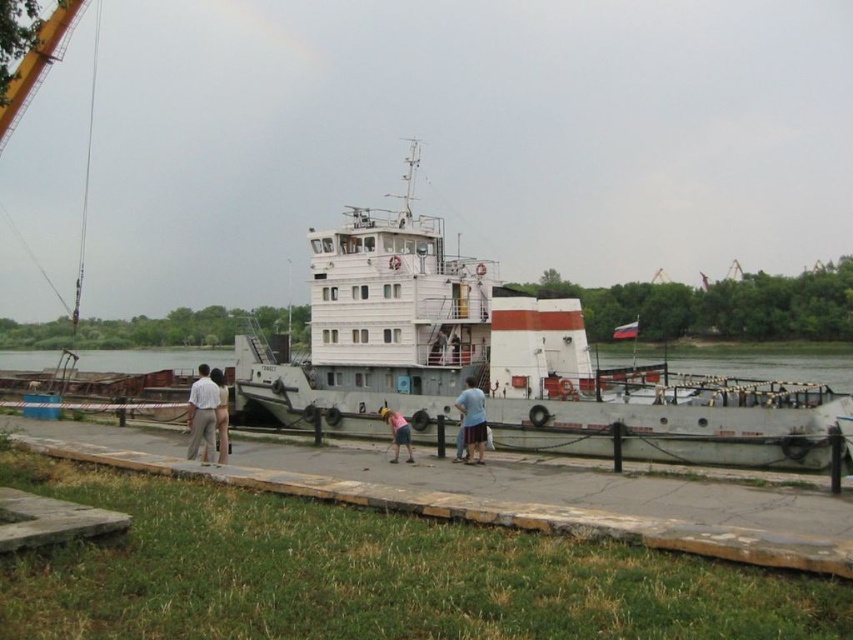
You are standing on the barge and want to take a photo of both the point at coordinates point (192, 442) and point (474, 410). Which point should you focus on first to ensure both are in focus?

You should focus on point (192, 442) first because it is closer to the camera than point (474, 410). This way, the depth of field will cover both points effectively.

You are standing on the riverside and looking at the white matte barge at center and the white cotton shirt at left. Which object is positioned higher from the ground?

The white matte barge at center is above the white cotton shirt at left, so it is positioned higher from the ground.